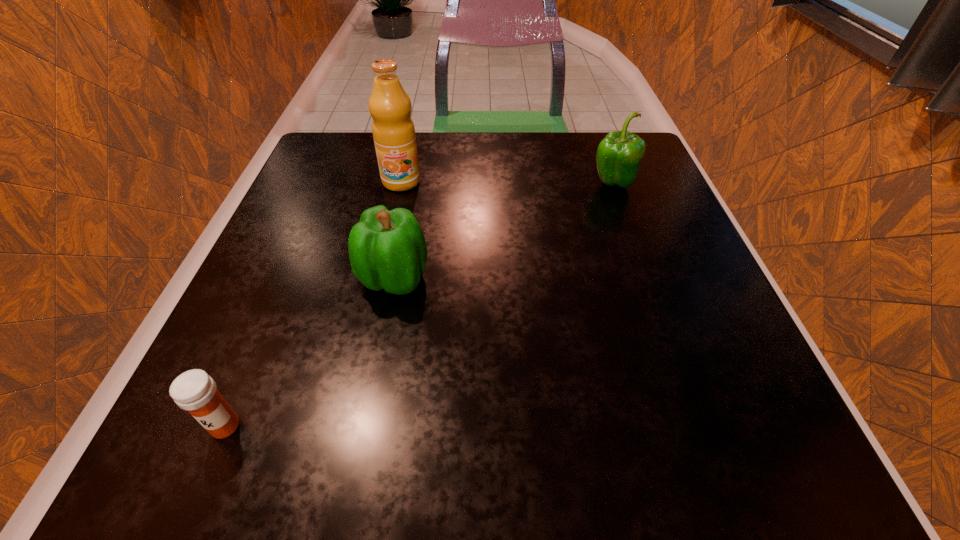
Identify the location of free space at the far left corner of the desktop. coord(348,165).

Where is `vacant region at the near left corner of the desktop`? The height and width of the screenshot is (540, 960). vacant region at the near left corner of the desktop is located at coordinates (168, 442).

Where is `free space at the far right corner`? This screenshot has width=960, height=540. free space at the far right corner is located at coordinates (638, 180).

The image size is (960, 540). Identify the location of free space between the second nearest object and the farther bell pepper. (503, 232).

Where is `free space between the fruit juice and the farther bell pepper`? The image size is (960, 540). free space between the fruit juice and the farther bell pepper is located at coordinates (507, 183).

This screenshot has width=960, height=540. Identify the location of vacant space that's between the tallest object and the farther bell pepper. (507, 183).

Identify the location of blank region between the fruit juice and the right bell pepper. (507, 183).

Where is `empty space between the nearer bell pepper and the shortest object`? This screenshot has height=540, width=960. empty space between the nearer bell pepper and the shortest object is located at coordinates (309, 352).

Identify the location of empty location between the right bell pepper and the left bell pepper. (503, 232).

Image resolution: width=960 pixels, height=540 pixels. What are the coordinates of `vacant point located between the shortest object and the right bell pepper` in the screenshot? It's located at (419, 305).